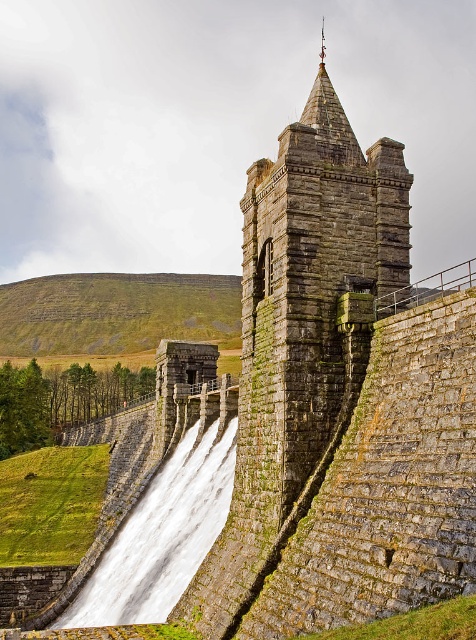
Which is above, rusty stone tower at upper center or white stone waterfall at lower left?

rusty stone tower at upper center is above.

Looking at this image, is rusty stone tower at upper center bigger than white stone waterfall at lower left?

No.

Identify the location of rusty stone tower at upper center. This screenshot has width=476, height=640. (308, 291).